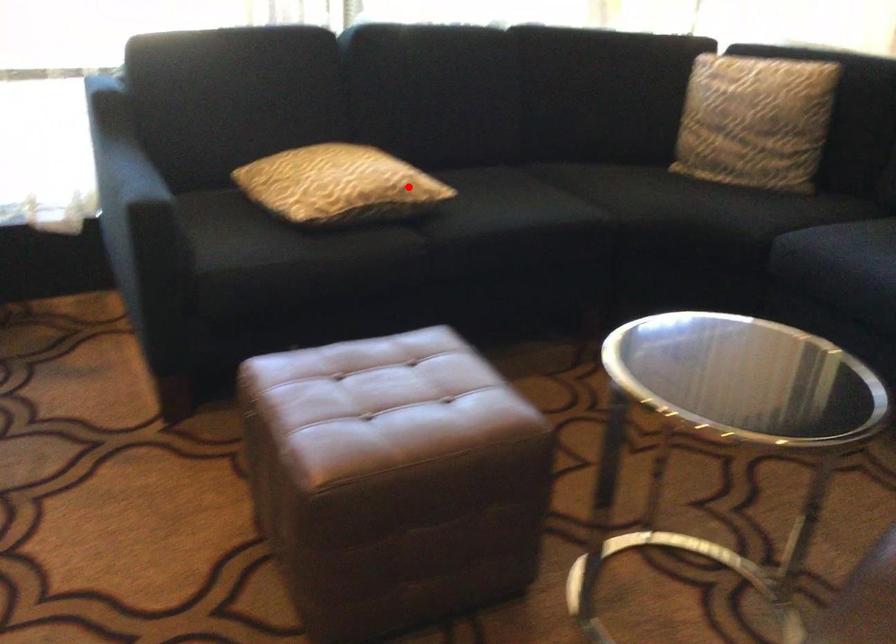
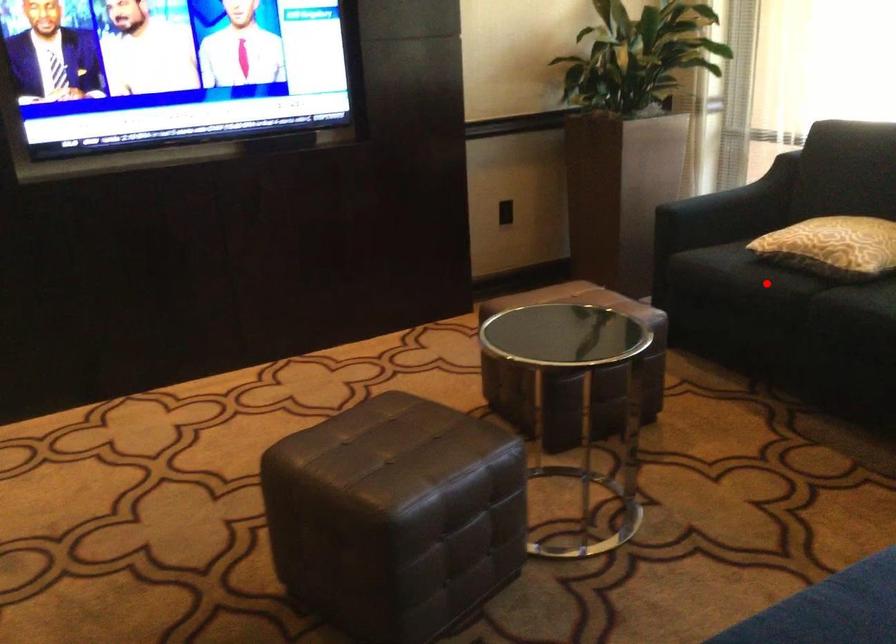
I am providing you with two images of the same scene from different viewpoints. A red point is marked on the first image and another point is marked on the second image. Is the red point in image1 aligned with the point shown in image2?

No